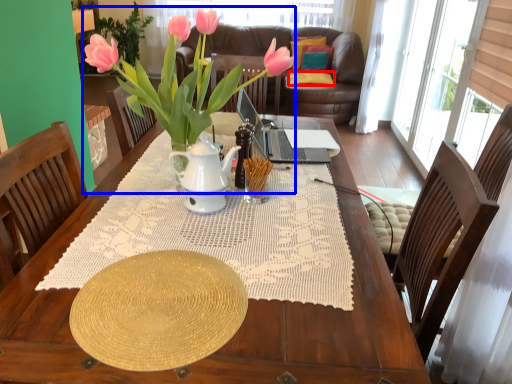
Question: Which point is further to the camera, pillow (highlighted by a red box) or houseplant (highlighted by a blue box)?

Choices:
 (A) pillow
 (B) houseplant

Answer: (A)